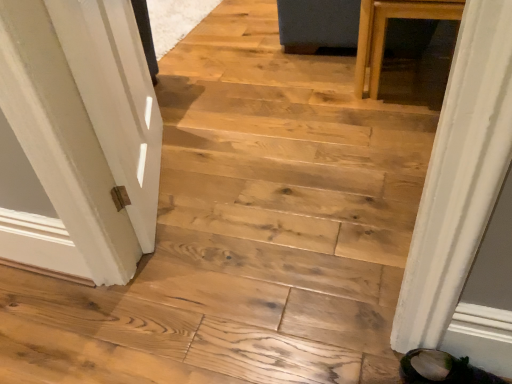
Question: From the image's perspective, relative to white painted wood door at left, is green suede shoe at lower right above or below?

Choices:
 (A) above
 (B) below

Answer: (B)

Question: Considering the positions of green suede shoe at lower right and white painted wood door at left in the image, is green suede shoe at lower right taller or shorter than white painted wood door at left?

Choices:
 (A) short
 (B) tall

Answer: (A)

Question: From a real-world perspective, relative to white painted wood door at left, is green suede shoe at lower right vertically above or below?

Choices:
 (A) above
 (B) below

Answer: (B)

Question: Is white painted wood door at left wider or thinner than green suede shoe at lower right?

Choices:
 (A) thin
 (B) wide

Answer: (A)

Question: Is point (56, 39) closer or farther from the camera than point (460, 375)?

Choices:
 (A) closer
 (B) farther

Answer: (A)

Question: Would you say white painted wood door at left is inside or outside green suede shoe at lower right?

Choices:
 (A) inside
 (B) outside

Answer: (B)

Question: In terms of size, does white painted wood door at left appear bigger or smaller than green suede shoe at lower right?

Choices:
 (A) big
 (B) small

Answer: (A)